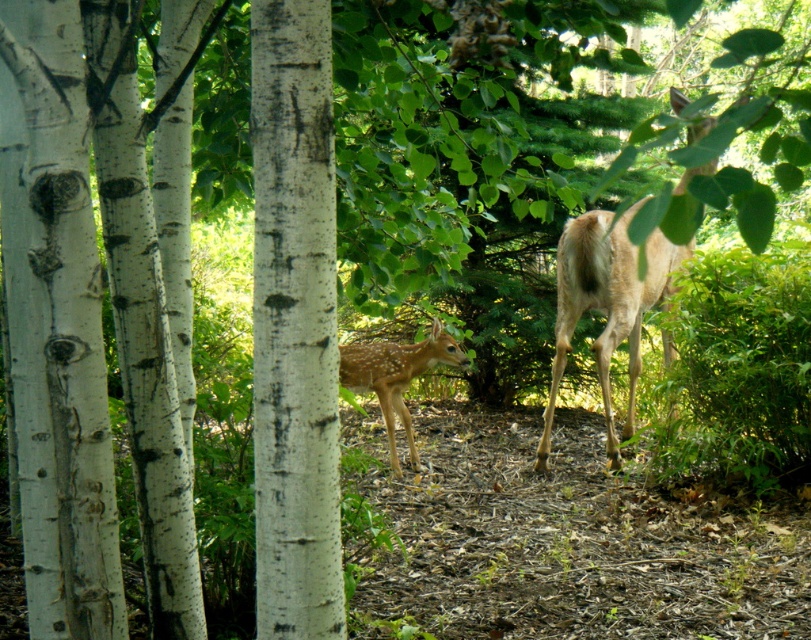
Question: Is light brown fur at right positioned behind fawn fur at center?

Choices:
 (A) no
 (B) yes

Answer: (B)

Question: Is light brown fur at right bigger than fawn fur at center?

Choices:
 (A) no
 (B) yes

Answer: (B)

Question: Which of the following is the farthest from the observer?

Choices:
 (A) (397, 380)
 (B) (650, 241)

Answer: (B)

Question: Which of the following is the farthest from the observer?

Choices:
 (A) light brown fur at right
 (B) fawn fur at center

Answer: (A)

Question: Which object is farther from the camera taking this photo?

Choices:
 (A) light brown fur at right
 (B) fawn fur at center

Answer: (A)

Question: Does light brown fur at right have a larger size compared to fawn fur at center?

Choices:
 (A) yes
 (B) no

Answer: (A)